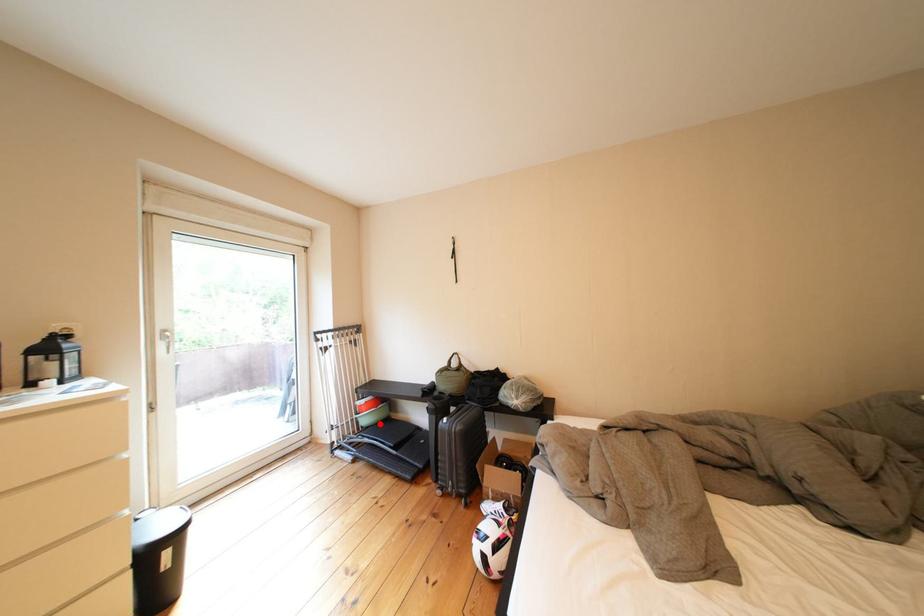
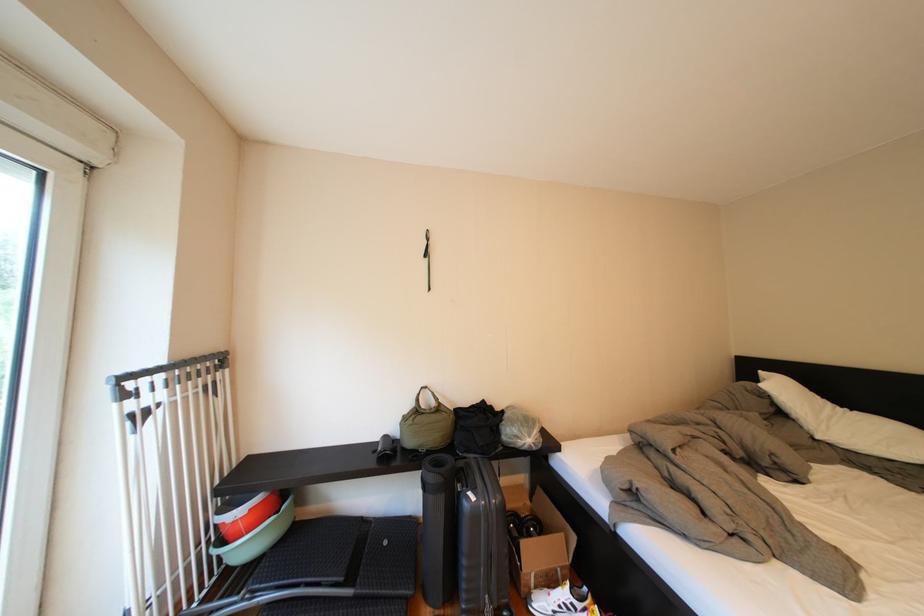
Find the pixel in the second image that matches the highlighted location in the first image.

(261, 551)